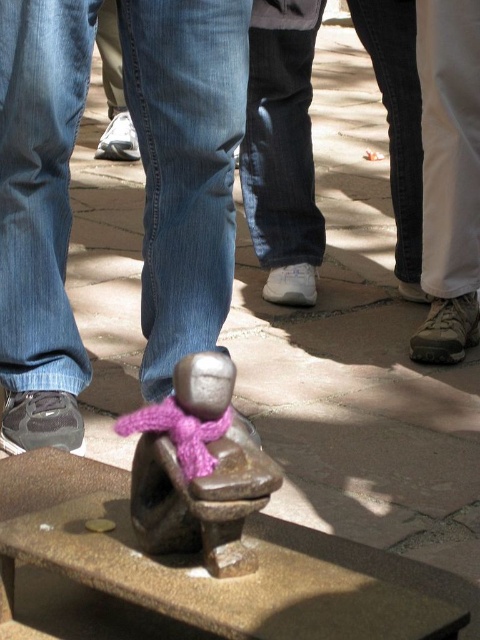
Based on the photo, you are a photographer trying to capture the sculpture in the center. You notice the white fabric pants at right and the white fabric shoe at lower left might block your view. Which object is closer to the camera, making it more likely to obstruct your shot?

The white fabric pants at right is taller than the white fabric shoe at lower left, so it is closer to the camera and more likely to obstruct the view of the sculpture.

You are standing in a public space and see the sculpture on the stone surface. If you want to take a photo of the sculpture without any people blocking it, where should you position yourself relative to the point at coordinates (435,10)?

You should position yourself 2.07 meters away from the point at coordinates (435,10) to ensure the sculpture is captured without any people blocking it.

You are standing in a public square and see the bronze statue at center and the bronze stone bench at center. Which object is closer to you?

The bronze statue at center is closer to you because it is positioned further to the viewer than the bronze stone bench at center.